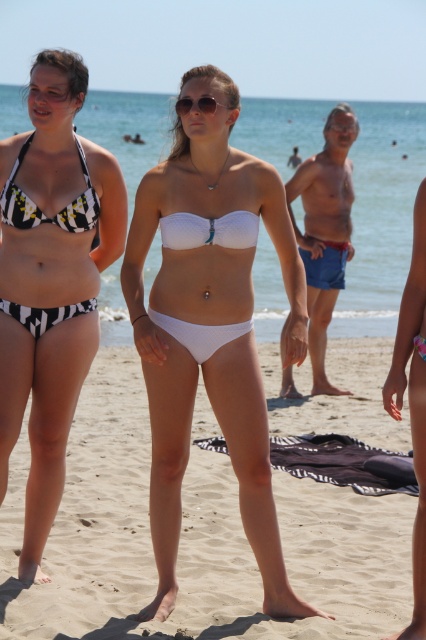
You are a lifeguard assessing the visibility of swimmers. You notice the white matte bikini at center and the black and white striped bikini top at left. Which swimmer might be harder to see from a distance due to their clothing?

The black and white striped bikini top at left might be harder to see from a distance because stripes can create a visual pattern that reduces visibility compared to a solid color like the white matte bikini at center.

You are a photographer trying to capture a closeup shot of the black and white printed bikini at left and the black and white striped bikini top at left. Given that your camera has a maximum focus range of 12 inches, will you be able to focus on both subjects simultaneously?

The black and white printed bikini at left and black and white striped bikini top at left are 13.26 inches apart from each other. Since the distance between them exceeds the camera maximum focus range of 12 inches, the photographer cannot focus on both subjects simultaneously.

You are a photographer trying to capture a candid shot of the white matte bikini at center in the beach scene. You are positioned at the point with coordinates point (210,326). Can you confirm if you are directly at the location where the white matte bikini at center is situated?

Yes, you are directly at the location of the white matte bikini at center since the coordinates point (210,326) indicate that the white matte bikini at center is located exactly at that point.